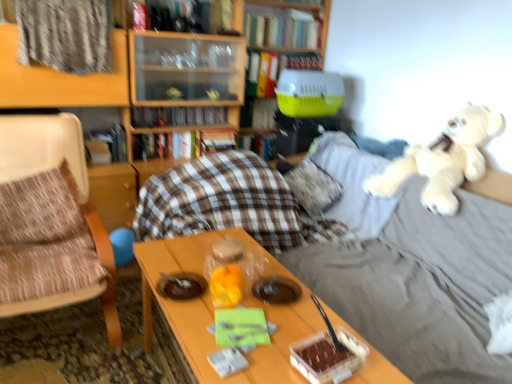
This screenshot has height=384, width=512. I want to click on empty space that is ontop of hardcover book at center, the third book positioned from the top (from a real-world perspective), so click(x=302, y=52).